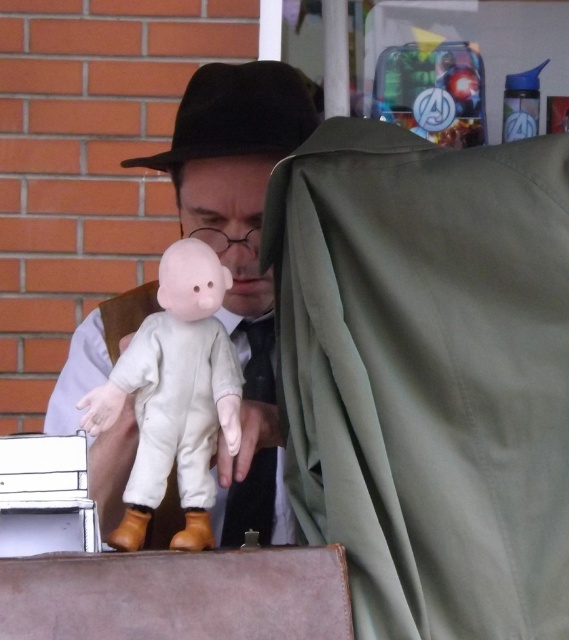
Between white fabric doll at center and black satin tie at center, which one appears on the left side from the viewer's perspective?

white fabric doll at center

Is white fabric doll at center thinner than black satin tie at center?

In fact, white fabric doll at center might be wider than black satin tie at center.

Between point (129, 365) and point (261, 356), which one is positioned behind?

The point (261, 356) is behind.

The width and height of the screenshot is (569, 640). What are the coordinates of `white fabric doll at center` in the screenshot? It's located at (175, 396).

Who is positioned more to the right, matte white doll at center or black felt fedora at upper center?

matte white doll at center

From the picture: Does matte white doll at center lie behind black felt fedora at upper center?

No.

This screenshot has width=569, height=640. What do you see at coordinates (241, 257) in the screenshot?
I see `matte white doll at center` at bounding box center [241, 257].

Locate an element on the screen. Image resolution: width=569 pixels, height=640 pixels. matte white doll at center is located at coordinates (241, 257).

Where is `matte white doll at center`? The width and height of the screenshot is (569, 640). matte white doll at center is located at coordinates (241, 257).

Is point (257, 333) in front of point (244, 486)?

That is False.

Where is `matte white doll at center`? matte white doll at center is located at coordinates (241, 257).